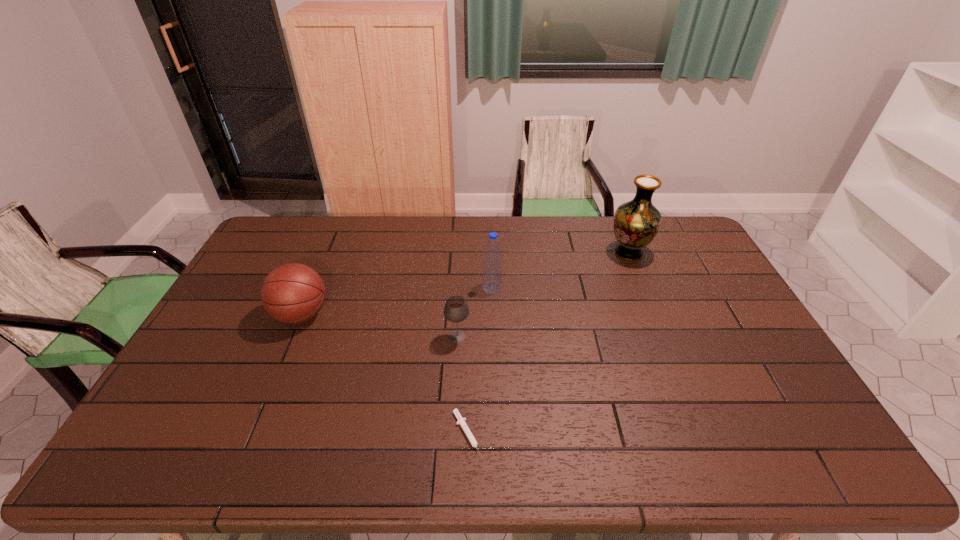
This screenshot has height=540, width=960. I want to click on the tallest object, so click(x=636, y=223).

Find the location of a particular element. Image resolution: width=960 pixels, height=540 pixels. vase is located at coordinates (636, 223).

The width and height of the screenshot is (960, 540). Identify the location of the fourth object from left to right. (492, 268).

Where is `water bottle`? The image size is (960, 540). water bottle is located at coordinates (492, 268).

Identify the location of basketball. (292, 293).

Find the location of `the leftmost object`. the leftmost object is located at coordinates (292, 293).

Where is `wineglass`? wineglass is located at coordinates (456, 309).

This screenshot has height=540, width=960. Identify the location of syringe. (461, 421).

Where is `the nearest object`? The height and width of the screenshot is (540, 960). the nearest object is located at coordinates (461, 421).

Image resolution: width=960 pixels, height=540 pixels. Find the location of `free space located on the right of the tallest object`. free space located on the right of the tallest object is located at coordinates (693, 253).